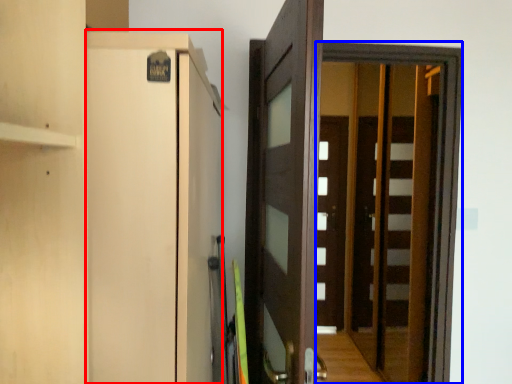
Question: Which object appears closest to the camera in this image, cabinetry (highlighted by a red box) or screen door (highlighted by a blue box)?

Choices:
 (A) cabinetry
 (B) screen door

Answer: (A)